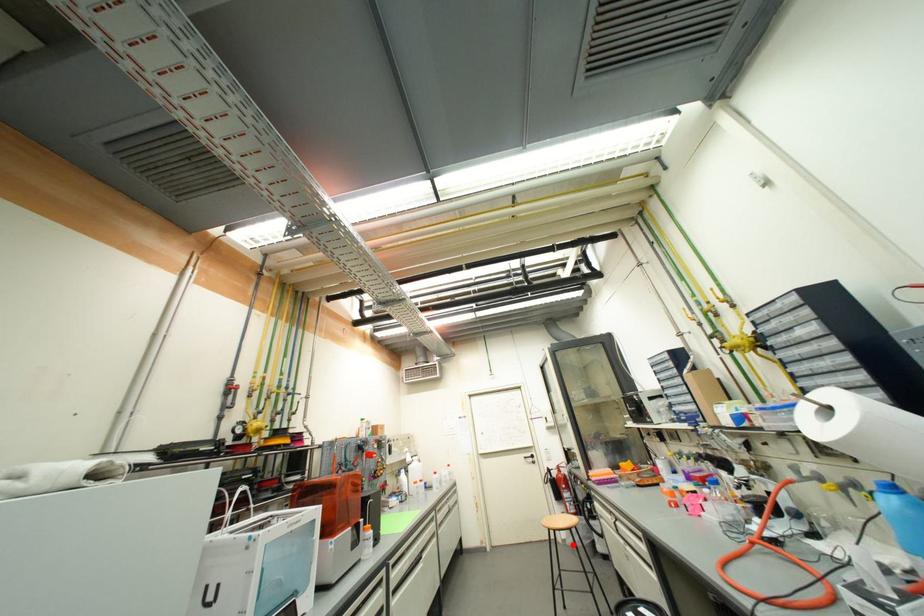
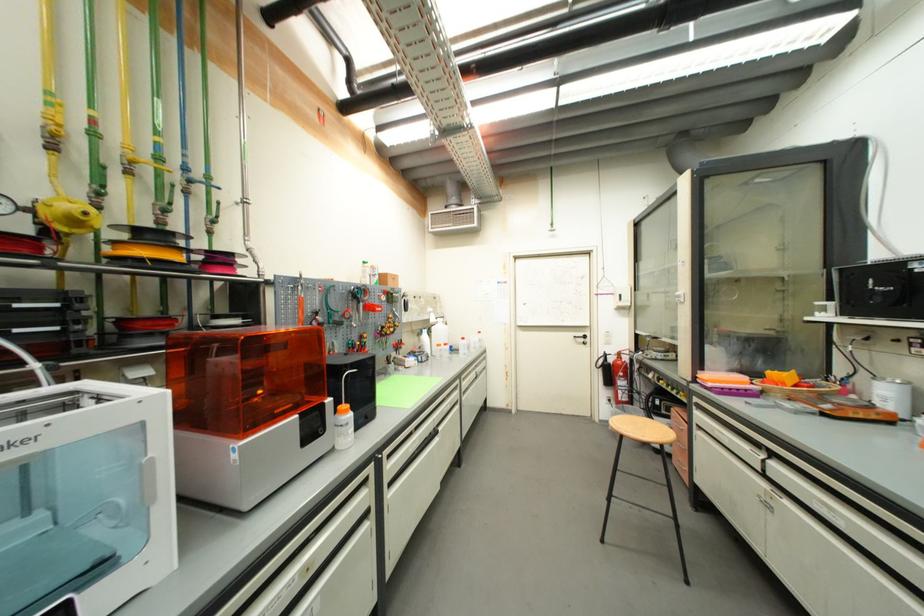
Question: A red point is marked in image1. In image2, is the corresponding 3D point closer to the camera or farther? Reply with the corresponding letter.

Choices:
 (A) The corresponding 3D point is closer.
 (B) The corresponding 3D point is farther.

Answer: (A)